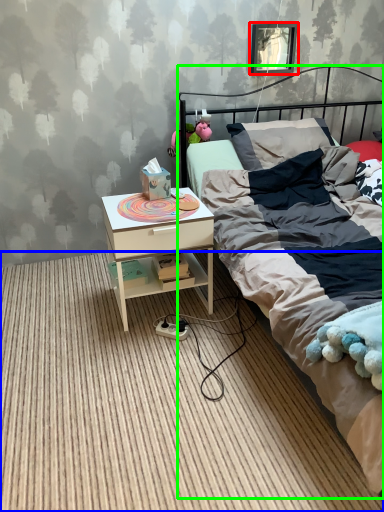
Question: Which object is the farthest from picture frame (highlighted by a red box)? Choose among these: plain (highlighted by a blue box) or bed (highlighted by a green box).

Choices:
 (A) plain
 (B) bed

Answer: (A)